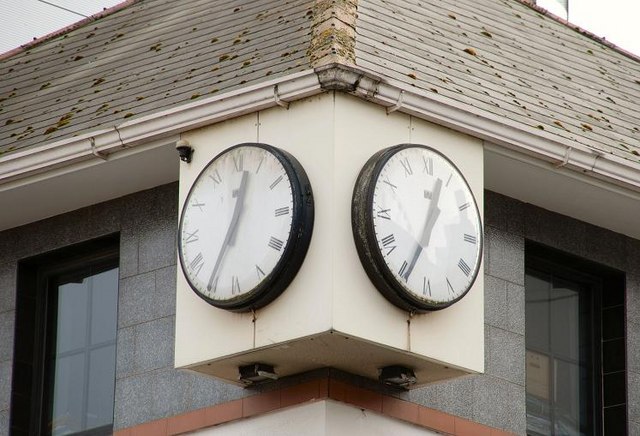
Find the location of `1 light`. 1 light is located at coordinates (184, 149).